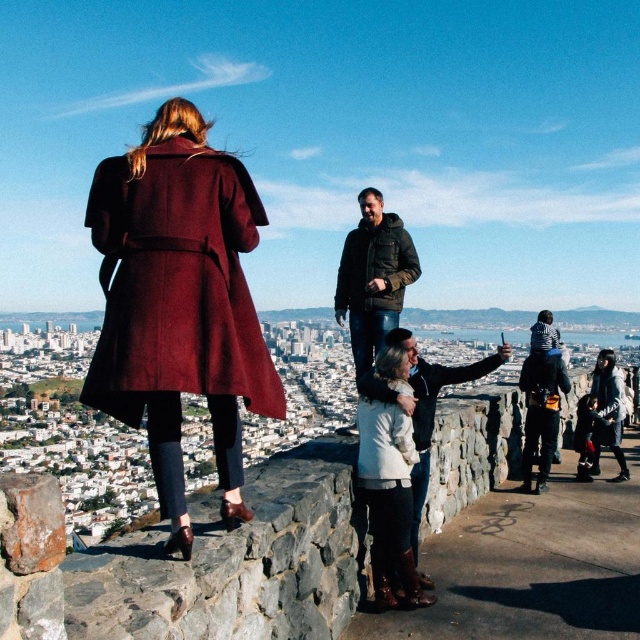
Who is taller, burgundy wool coat at upper left or white matte coat at lower center?

burgundy wool coat at upper left

Between point (108, 336) and point (403, 500), which one is positioned behind?

The point (403, 500) is behind.

I want to click on burgundy wool coat at upper left, so click(177, 282).

Which of these two, burgundy wool coat at upper left or green textured jacket at center, stands shorter?

Standing shorter between the two is green textured jacket at center.

Does burgundy wool coat at upper left have a smaller size compared to green textured jacket at center?

Actually, burgundy wool coat at upper left might be larger than green textured jacket at center.

The height and width of the screenshot is (640, 640). What do you see at coordinates (177, 282) in the screenshot?
I see `burgundy wool coat at upper left` at bounding box center [177, 282].

Where is `burgundy wool coat at upper left`? The height and width of the screenshot is (640, 640). burgundy wool coat at upper left is located at coordinates 177,282.

Can you confirm if green textured jacket at center is taller than matte black jacket at lower right?

Correct, green textured jacket at center is much taller as matte black jacket at lower right.

Is point (353, 324) less distant than point (620, 406)?

Yes, it is.

Find the location of a particular element. green textured jacket at center is located at coordinates (372, 276).